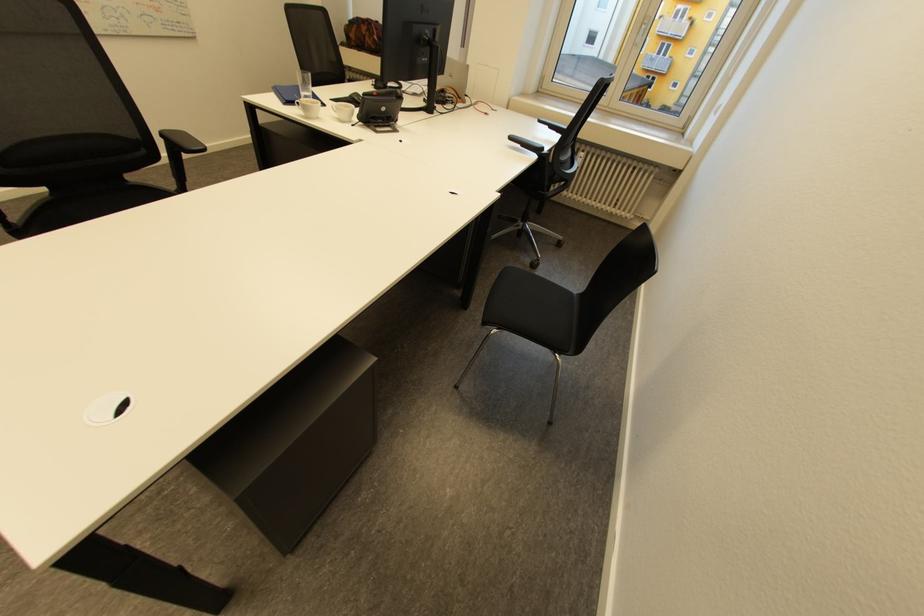
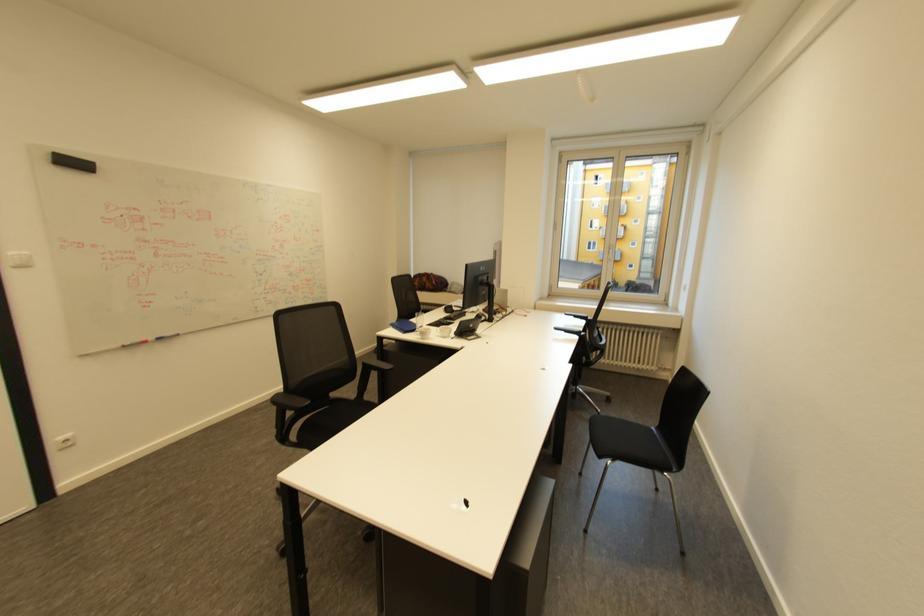
In the second image, find the point that corresponds to the point at 672,107 in the first image.

(636, 281)